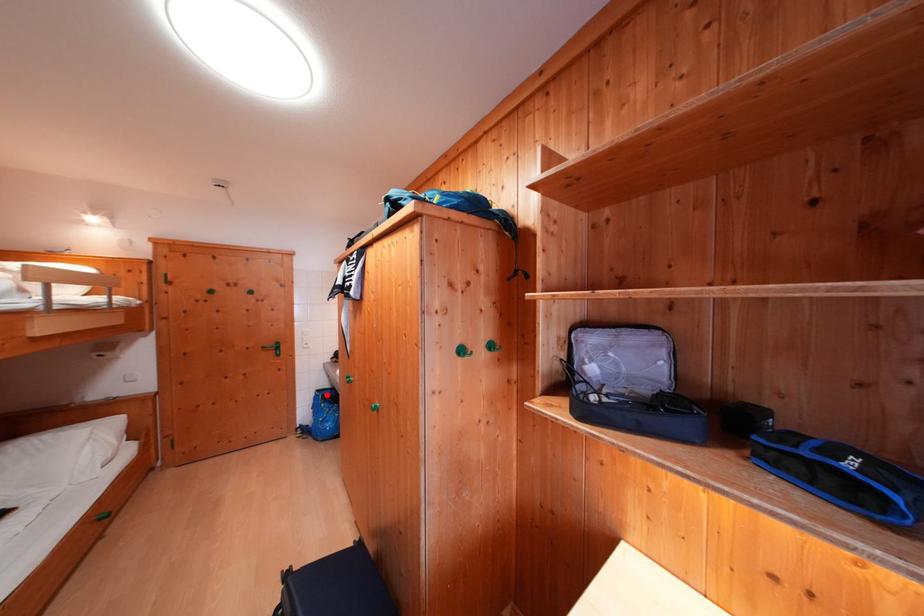
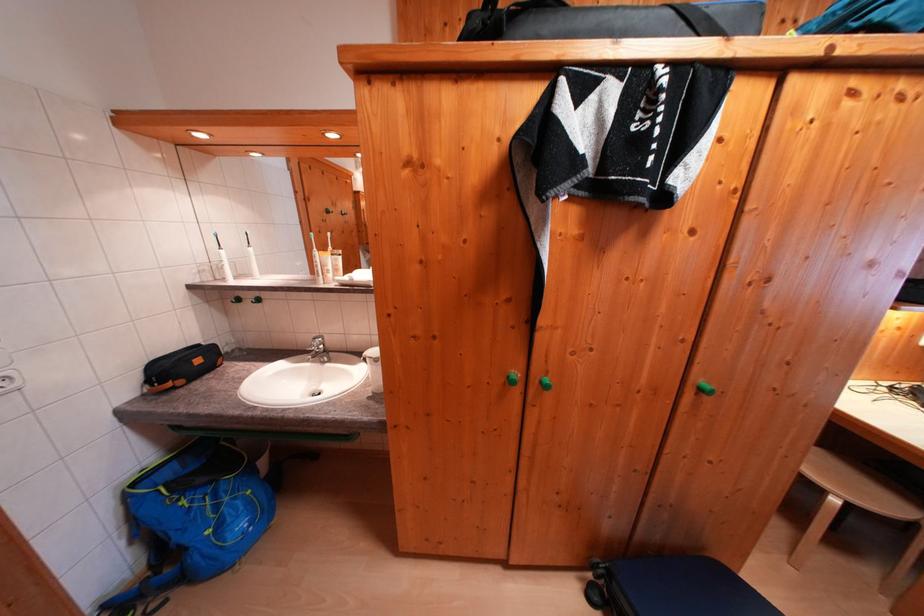
Find the pixel in the second image that matches the highlighted location in the first image.

(142, 488)